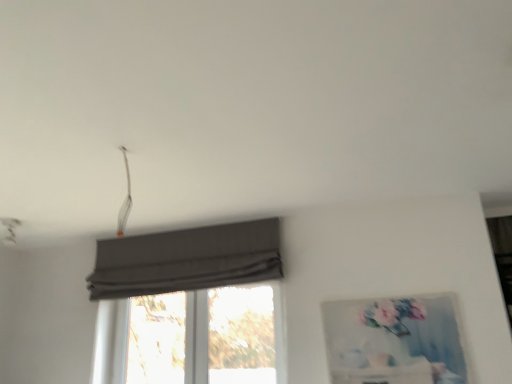
Question: Should I look upward or downward to see dark gray fabric curtain at center?

Choices:
 (A) down
 (B) up

Answer: (A)

Question: Is transparent glass window at center wider than matte gray picture frame at right?

Choices:
 (A) yes
 (B) no

Answer: (A)

Question: Is transparent glass window at center bigger than matte gray picture frame at right?

Choices:
 (A) no
 (B) yes

Answer: (B)

Question: Is transparent glass window at center beside matte gray picture frame at right?

Choices:
 (A) no
 (B) yes

Answer: (A)

Question: From a real-world perspective, is transparent glass window at center physically below matte gray picture frame at right?

Choices:
 (A) yes
 (B) no

Answer: (B)

Question: Can you confirm if transparent glass window at center is shorter than matte gray picture frame at right?

Choices:
 (A) yes
 (B) no

Answer: (B)

Question: Is the depth of transparent glass window at center less than that of matte gray picture frame at right?

Choices:
 (A) yes
 (B) no

Answer: (B)

Question: Is transparent glass window at center outside dark gray fabric curtain at center?

Choices:
 (A) no
 (B) yes

Answer: (B)

Question: Does transparent glass window at center have a lesser height compared to dark gray fabric curtain at center?

Choices:
 (A) yes
 (B) no

Answer: (B)

Question: From the image's perspective, is transparent glass window at center located beneath dark gray fabric curtain at center?

Choices:
 (A) yes
 (B) no

Answer: (A)

Question: Is transparent glass window at center closer to the viewer compared to dark gray fabric curtain at center?

Choices:
 (A) no
 (B) yes

Answer: (A)

Question: Can you confirm if transparent glass window at center is bigger than dark gray fabric curtain at center?

Choices:
 (A) no
 (B) yes

Answer: (A)

Question: Is transparent glass window at center thinner than dark gray fabric curtain at center?

Choices:
 (A) no
 (B) yes

Answer: (B)

Question: From the image's perspective, is dark gray fabric curtain at center below transparent glass window at center?

Choices:
 (A) no
 (B) yes

Answer: (A)